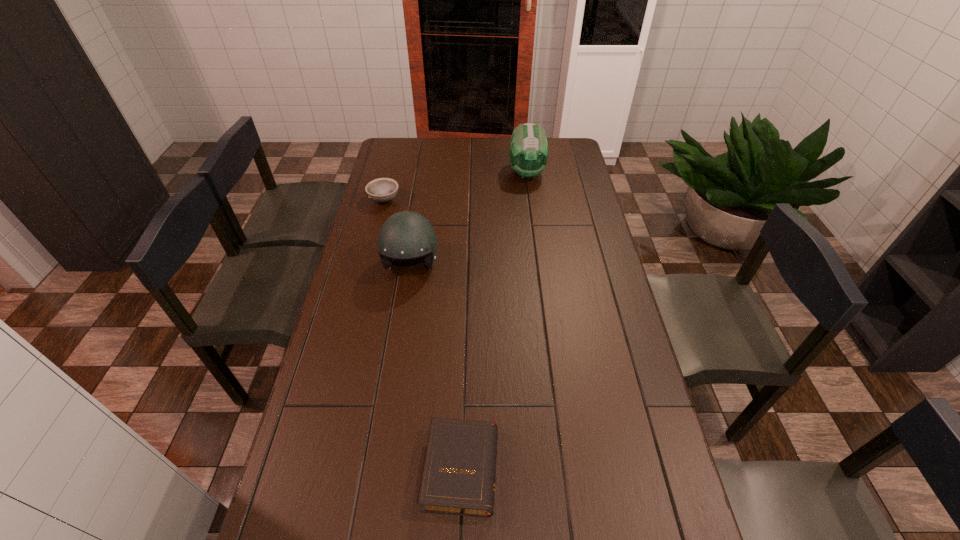
This screenshot has height=540, width=960. In order to click on vacant space that satisfies the following two spatial constraints: 1. on the front side of the nearest object; 2. on the right side of the bowl in this screenshot , I will do `click(317, 468)`.

The height and width of the screenshot is (540, 960). I want to click on free location that satisfies the following two spatial constraints: 1. at the face opening of the nearest object; 2. on the left side of the nearer football helmet, so click(379, 468).

Identify the location of free space that satisfies the following two spatial constraints: 1. at the face opening of the nearest object; 2. on the right side of the third farthest object. (379, 468).